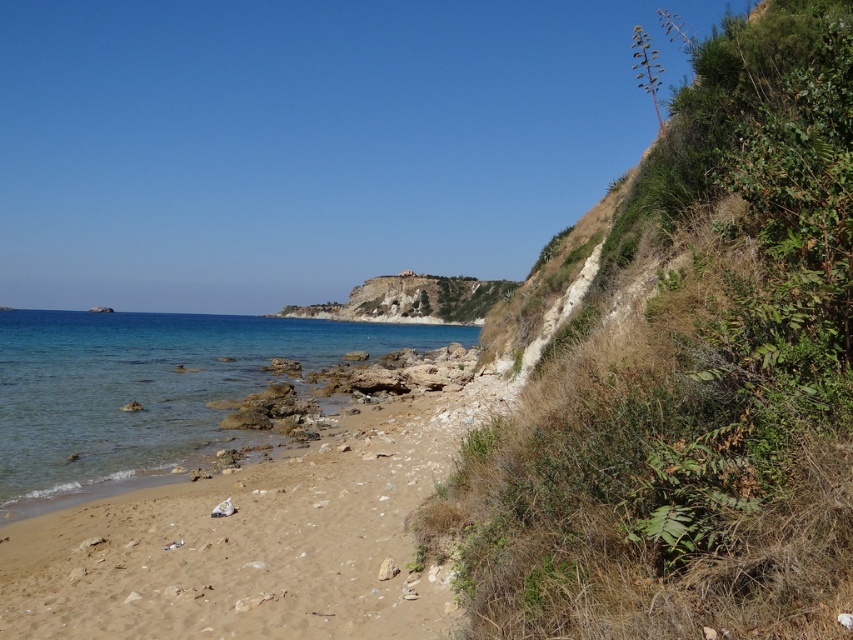
Question: Does light brown sandy beach at lower center come in front of clear blue water at lower left?

Choices:
 (A) no
 (B) yes

Answer: (B)

Question: Which object appears farthest from the camera in this image?

Choices:
 (A) light brown sandy beach at lower center
 (B) clear blue water at lower left

Answer: (B)

Question: Observing the image, what is the correct spatial positioning of light brown sandy beach at lower center in reference to clear blue water at lower left?

Choices:
 (A) above
 (B) below

Answer: (B)

Question: Among these objects, which one is farthest from the camera?

Choices:
 (A) light brown sandy beach at lower center
 (B) clear blue water at lower left

Answer: (B)

Question: Is light brown sandy beach at lower center above clear blue water at lower left?

Choices:
 (A) yes
 (B) no

Answer: (B)